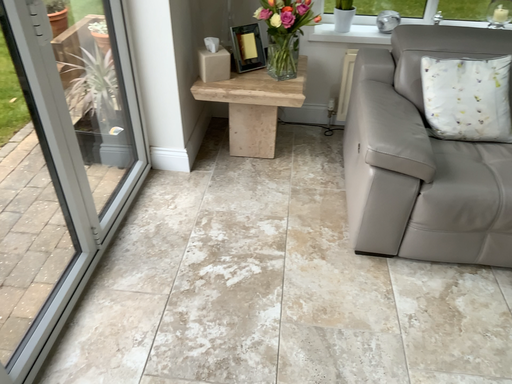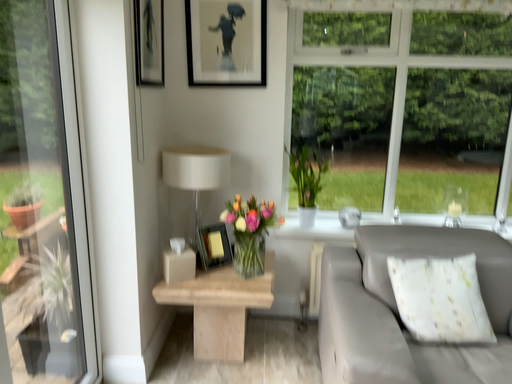
Question: How did the camera likely rotate when shooting the video?

Choices:
 (A) rotated downward
 (B) rotated upward

Answer: (B)